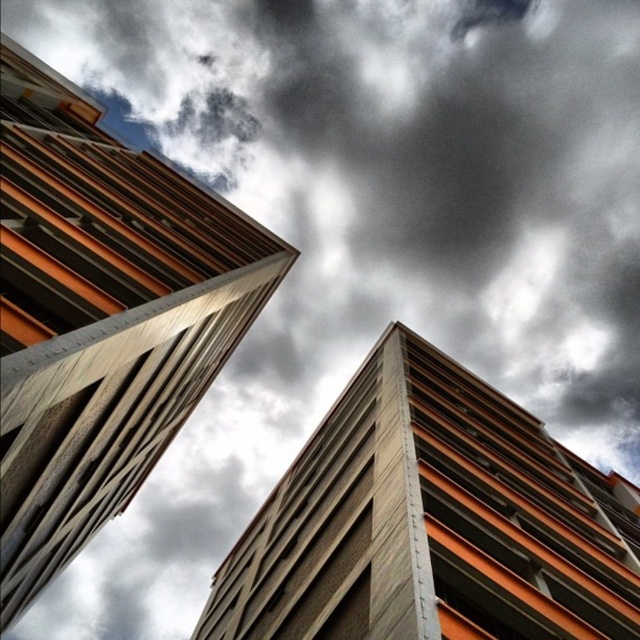
Question: Does orange concrete building at left have a greater width compared to orange concrete building at center?

Choices:
 (A) yes
 (B) no

Answer: (B)

Question: Which point is closer to the camera?

Choices:
 (A) (16, 305)
 (B) (285, 627)

Answer: (A)

Question: Does orange concrete building at left come behind orange concrete building at center?

Choices:
 (A) no
 (B) yes

Answer: (B)

Question: Which point is closer to the camera?

Choices:
 (A) (416, 416)
 (B) (32, 449)

Answer: (B)

Question: Can you confirm if orange concrete building at left is positioned above orange concrete building at center?

Choices:
 (A) no
 (B) yes

Answer: (B)